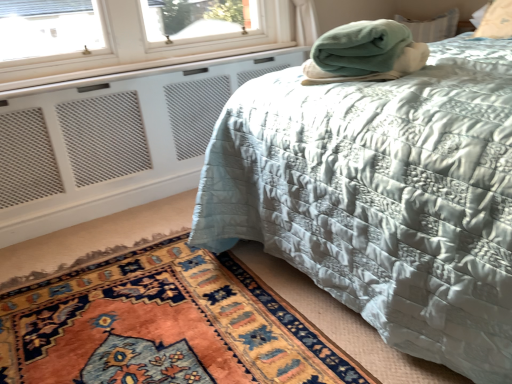
Question: Is green fleece blanket at upper right looking in the opposite direction of carpeted rug at lower left?

Choices:
 (A) yes
 (B) no

Answer: (B)

Question: From the image's perspective, is green fleece blanket at upper right under carpeted rug at lower left?

Choices:
 (A) no
 (B) yes

Answer: (A)

Question: Is green fleece blanket at upper right bigger than carpeted rug at lower left?

Choices:
 (A) yes
 (B) no

Answer: (B)

Question: Is carpeted rug at lower left surrounded by green fleece blanket at upper right?

Choices:
 (A) yes
 (B) no

Answer: (B)

Question: Is green fleece blanket at upper right further to the viewer compared to carpeted rug at lower left?

Choices:
 (A) no
 (B) yes

Answer: (B)

Question: In terms of height, does white mesh radiator at lower left look taller or shorter compared to silky blue quilt at center?

Choices:
 (A) short
 (B) tall

Answer: (A)

Question: From a real-world perspective, is white mesh radiator at lower left positioned above or below silky blue quilt at center?

Choices:
 (A) below
 (B) above

Answer: (A)

Question: In terms of size, does white mesh radiator at lower left appear bigger or smaller than silky blue quilt at center?

Choices:
 (A) small
 (B) big

Answer: (A)

Question: From the image's perspective, relative to silky blue quilt at center, is white mesh radiator at lower left above or below?

Choices:
 (A) below
 (B) above

Answer: (A)

Question: From a real-world perspective, is silky blue quilt at center above or below carpeted rug at lower left?

Choices:
 (A) above
 (B) below

Answer: (A)

Question: From the image's perspective, relative to carpeted rug at lower left, is silky blue quilt at center above or below?

Choices:
 (A) below
 (B) above

Answer: (B)

Question: Considering the positions of point (379, 215) and point (282, 369), is point (379, 215) closer or farther from the camera than point (282, 369)?

Choices:
 (A) farther
 (B) closer

Answer: (B)

Question: Is silky blue quilt at center spatially inside carpeted rug at lower left, or outside of it?

Choices:
 (A) inside
 (B) outside

Answer: (B)

Question: Choose the correct answer: Is silky blue quilt at center inside white mesh radiator at lower left or outside it?

Choices:
 (A) inside
 (B) outside

Answer: (B)

Question: From a real-world perspective, is silky blue quilt at center above or below white mesh radiator at lower left?

Choices:
 (A) below
 (B) above

Answer: (B)